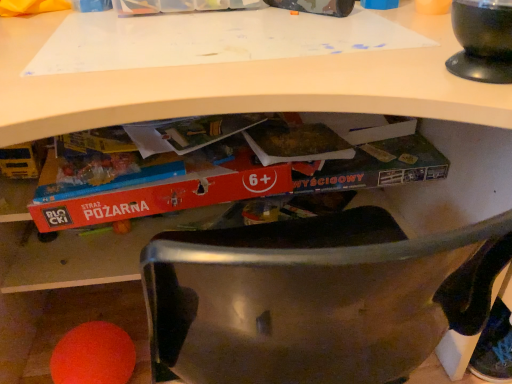
You are a GUI agent. You are given a task and a screenshot of the screen. Output one action in this format:
    pyautogui.click(x=<x>, y=<y>)
    Task: Click on the free space above red cardboard book at center (from a real-world perspective)
    
    Given the screenshot: What is the action you would take?
    pyautogui.click(x=180, y=134)